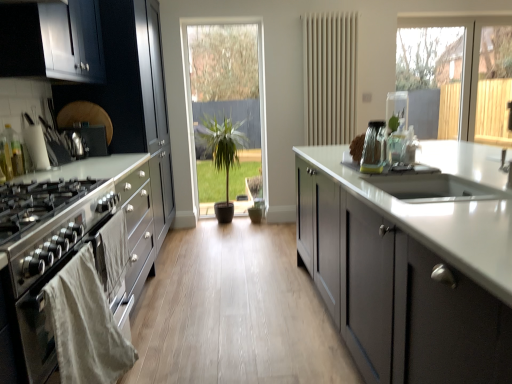
Image resolution: width=512 pixels, height=384 pixels. I want to click on free space in front of green leafy plant at center, so click(x=229, y=224).